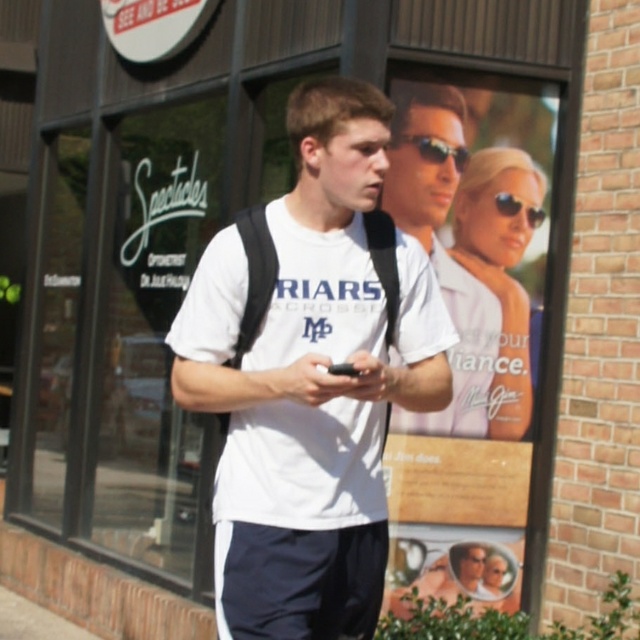
Does white matte t-shirt at center have a larger size compared to black plastic sunglasses at upper center?

Indeed, white matte t-shirt at center has a larger size compared to black plastic sunglasses at upper center.

Looking at this image, does white matte t-shirt at center appear on the left side of black plastic sunglasses at upper center?

Correct, you'll find white matte t-shirt at center to the left of black plastic sunglasses at upper center.

Is point (355, 470) positioned in front of point (419, 134)?

Yes, point (355, 470) is in front of point (419, 134).

Find the location of `white matte t-shirt at center`. white matte t-shirt at center is located at coordinates (310, 380).

Can you confirm if matte white shirt at center is smaller than black plastic sunglasses at upper center?

No.

Is matte white shirt at center taller than black plastic sunglasses at upper center?

Yes, matte white shirt at center is taller than black plastic sunglasses at upper center.

Who is more forward, (x=417, y=84) or (x=445, y=154)?

Point (x=417, y=84) is more forward.

In order to click on matte white shirt at center in this screenshot , I will do `click(442, 248)`.

Does white matte t-shirt at center appear on the right side of matte white shirt at center?

In fact, white matte t-shirt at center is to the left of matte white shirt at center.

Is point (369, 193) positioned in front of point (440, 282)?

Yes, it is in front of point (440, 282).

Is point (376, 609) more distant than point (461, 136)?

No, it is in front of (461, 136).

At what (x,y) coordinates should I click in order to perform the action: click on white matte t-shirt at center. Please return your answer as a coordinate pair (x, y). The width and height of the screenshot is (640, 640). Looking at the image, I should click on (310, 380).